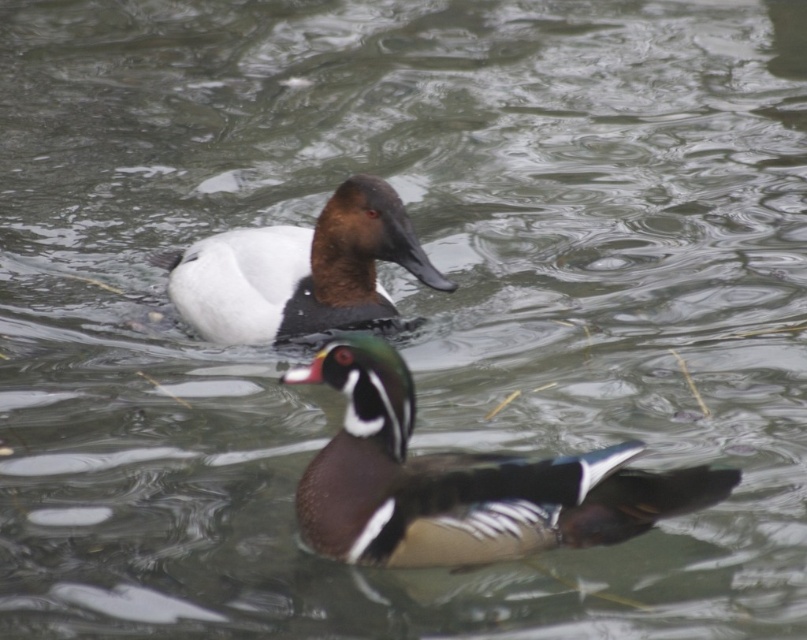
Where is `shiny brown duck at center`? Image resolution: width=807 pixels, height=640 pixels. shiny brown duck at center is located at coordinates (463, 481).

Which of these two, shiny brown duck at center or white matte duck at upper center, stands taller?

white matte duck at upper center

Who is more forward, (670,500) or (214,244)?

Positioned in front is point (670,500).

What are the coordinates of `shiny brown duck at center` in the screenshot? It's located at (463, 481).